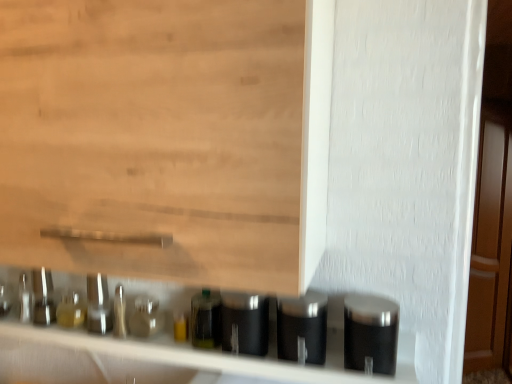
Question: Does satin metallic canister at center, which is counted as the 1th silver, starting from the left, appear on the right side of satin black container at right, arranged as the third silver when viewed from the left?

Choices:
 (A) yes
 (B) no

Answer: (B)

Question: Is the position of satin metallic canister at center, marked as the third silver in a right-to-left arrangement, less distant than that of satin black container at right, which is the first silver in right-to-left order?

Choices:
 (A) yes
 (B) no

Answer: (B)

Question: From a real-world perspective, is satin metallic canister at center, marked as the third silver in a right-to-left arrangement, below satin black container at right, arranged as the third silver when viewed from the left?

Choices:
 (A) yes
 (B) no

Answer: (A)

Question: From the image's perspective, is satin metallic canister at center, marked as the third silver in a right-to-left arrangement, below satin black container at right, arranged as the third silver when viewed from the left?

Choices:
 (A) no
 (B) yes

Answer: (A)

Question: Does satin metallic canister at center, marked as the third silver in a right-to-left arrangement, appear on the left side of satin black container at right, arranged as the third silver when viewed from the left?

Choices:
 (A) no
 (B) yes

Answer: (B)

Question: Is the surface of satin metallic canister at center, which is counted as the 1th silver, starting from the left, in direct contact with satin black container at right, which is the first silver in right-to-left order?

Choices:
 (A) yes
 (B) no

Answer: (B)

Question: Is satin silver canister at lower center, which is counted as the 2th silver, starting from the right, further to the viewer compared to black matte canisters at lower center?

Choices:
 (A) yes
 (B) no

Answer: (A)

Question: Considering the relative sizes of satin silver canister at lower center, which appears as the 2th silver when viewed from the left, and black matte canisters at lower center in the image provided, is satin silver canister at lower center, which appears as the 2th silver when viewed from the left, thinner than black matte canisters at lower center?

Choices:
 (A) no
 (B) yes

Answer: (B)

Question: From the image's perspective, is satin silver canister at lower center, which is counted as the 2th silver, starting from the right, under black matte canisters at lower center?

Choices:
 (A) yes
 (B) no

Answer: (B)

Question: Is satin silver canister at lower center, which is counted as the 2th silver, starting from the right, located outside black matte canisters at lower center?

Choices:
 (A) no
 (B) yes

Answer: (A)

Question: From the image's perspective, is satin silver canister at lower center, which is counted as the 2th silver, starting from the right, located above black matte canisters at lower center?

Choices:
 (A) yes
 (B) no

Answer: (A)

Question: Is satin silver canister at lower center, which appears as the 2th silver when viewed from the left, oriented away from black matte canisters at lower center?

Choices:
 (A) no
 (B) yes

Answer: (A)

Question: Is translucent glass bottle at center to the left of black matte canisters at lower center from the viewer's perspective?

Choices:
 (A) yes
 (B) no

Answer: (B)